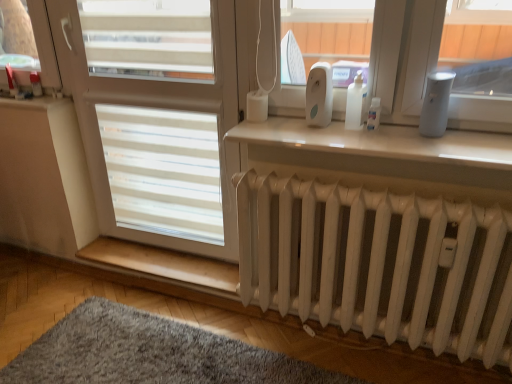
Find the location of a particular element. vacant space underneath white matte screen door at center (from a real-world perspective) is located at coordinates (172, 253).